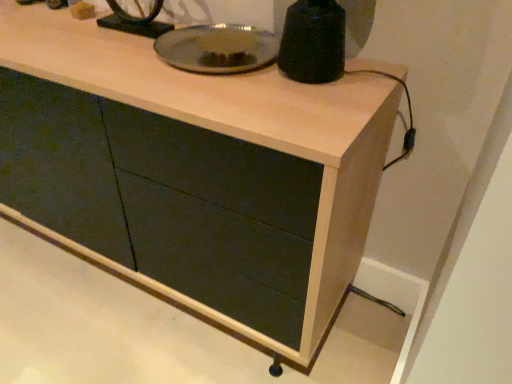
The image size is (512, 384). Describe the element at coordinates (217, 48) in the screenshot. I see `shiny glass plate at center` at that location.

What is the approximate width of shiny glass plate at center?

The width of shiny glass plate at center is 11.66 inches.

The height and width of the screenshot is (384, 512). What are the coordinates of `shiny glass plate at center` in the screenshot? It's located at (217, 48).

I want to click on shiny glass plate at center, so click(217, 48).